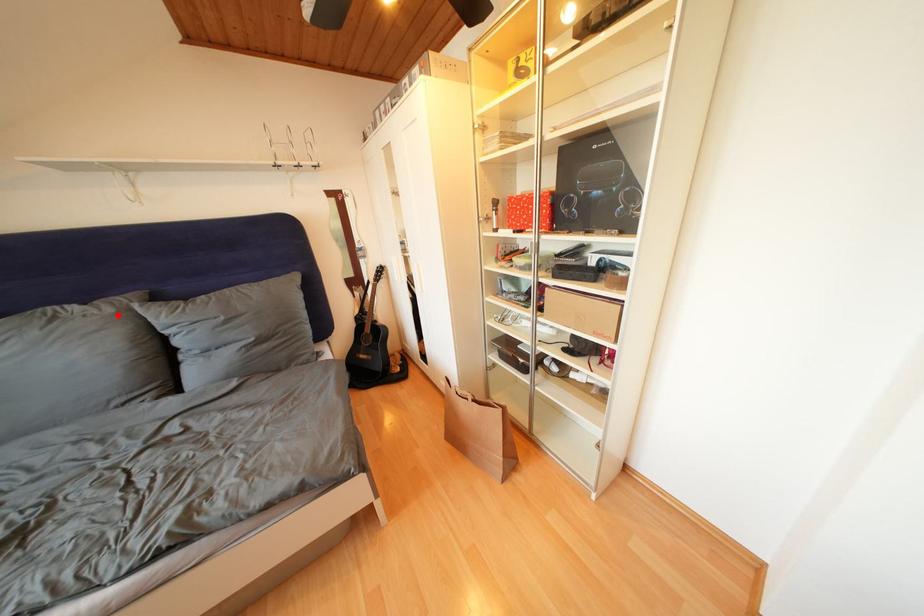
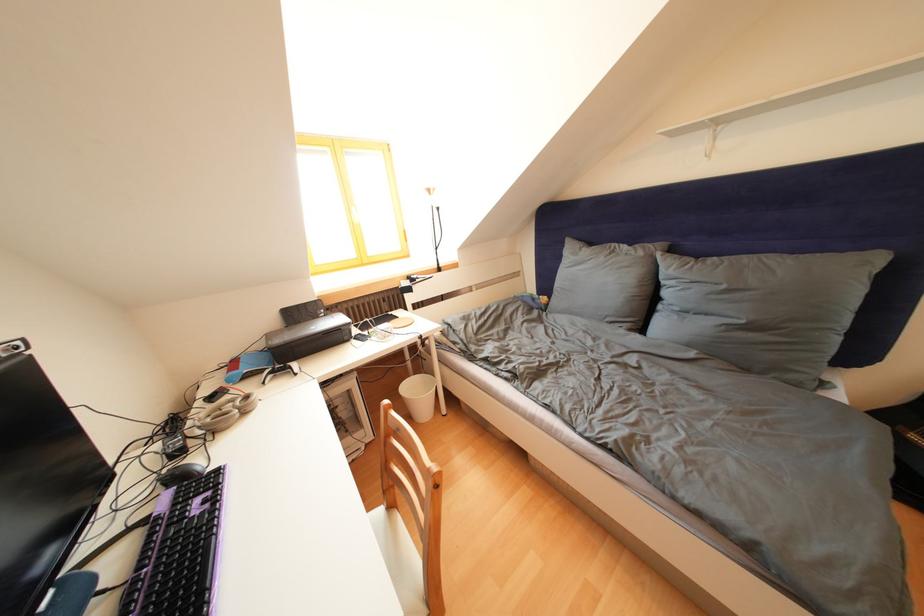
Where in the second image is the point corresponding to the highlighted location from the first image?

(649, 259)